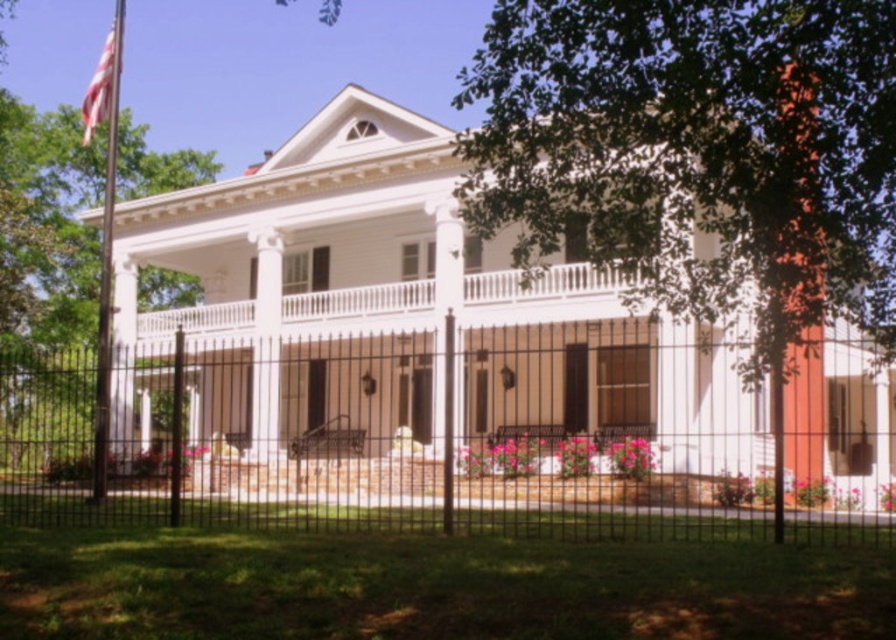
You are planning to install a new garden light between the black wrought iron fence at center and the green leafy tree at upper right. The light requires a minimum of 5 meters of space between the fence and the tree to be installed safely. Can you install the light between them?

The distance between the black wrought iron fence at center and the green leafy tree at upper right is 7.72 meters, which is more than the required 5 meters. Therefore, the garden light can be safely installed between them.

You are a visitor approaching the house and notice the black wrought iron fence at center and the metallic flag pole at left. From your perspective, which object is closer to the left side of the scene?

The metallic flag pole at left is closer to the left side of the scene because the black wrought iron fence at center is positioned to its right.

You are standing at the front gate of the house and want to walk towards the house. There are two points marked on the path. The first point is at point (589, 144) and the second point is at point (85, 122). Which point should you reach first as you walk towards the house?

You should reach point (589, 144) first because it is in front of point (85, 122) along the path towards the house.